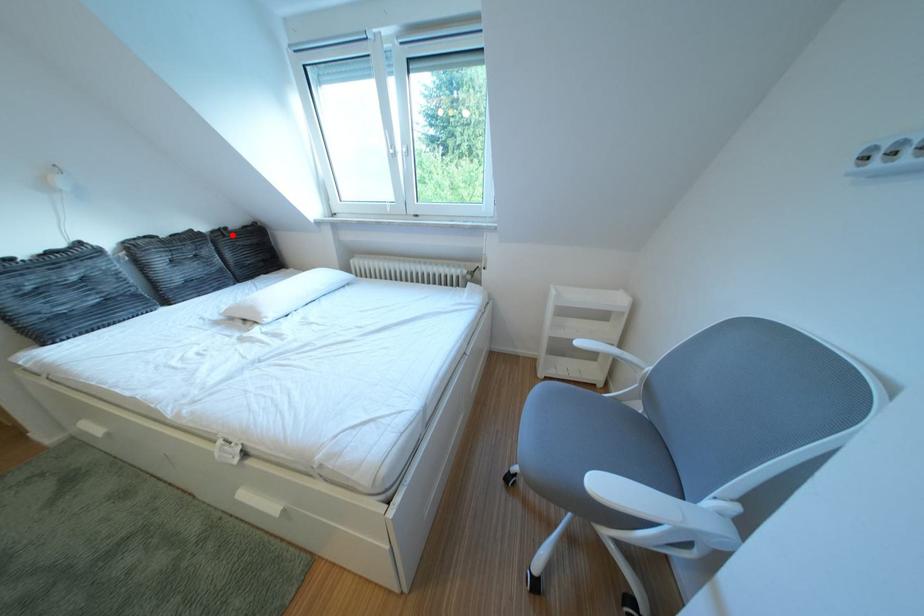
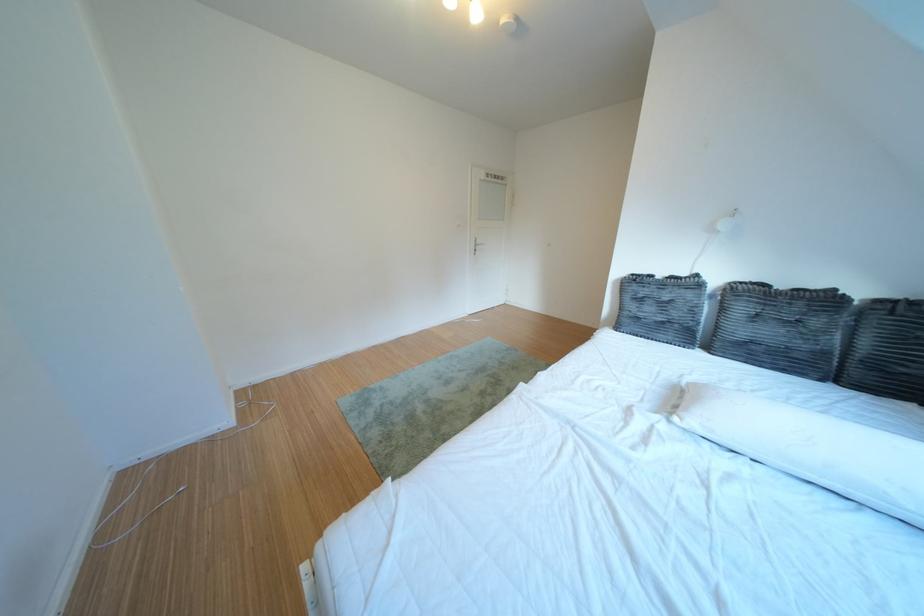
Find the pixel in the second image that matches the highlighted location in the first image.

(910, 306)